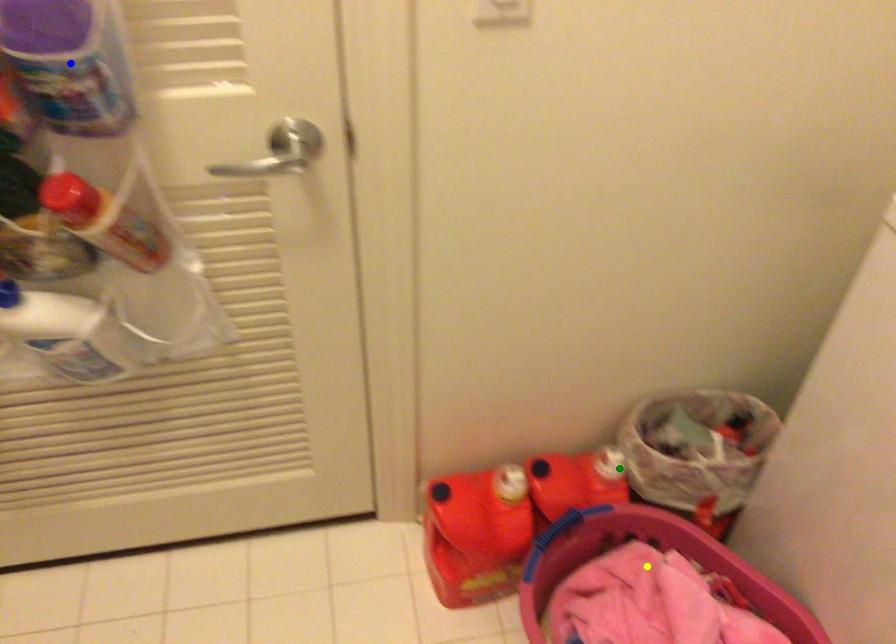
Order these from nearest to farthest:
yellow point
green point
blue point

1. green point
2. yellow point
3. blue point